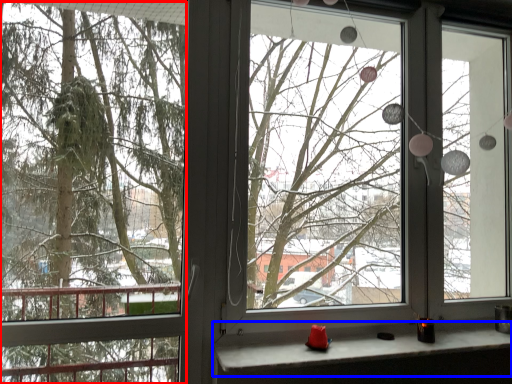
Question: Which object is closer to the camera taking this photo, tree (highlighted by a red box) or window sill (highlighted by a blue box)?

Choices:
 (A) tree
 (B) window sill

Answer: (A)